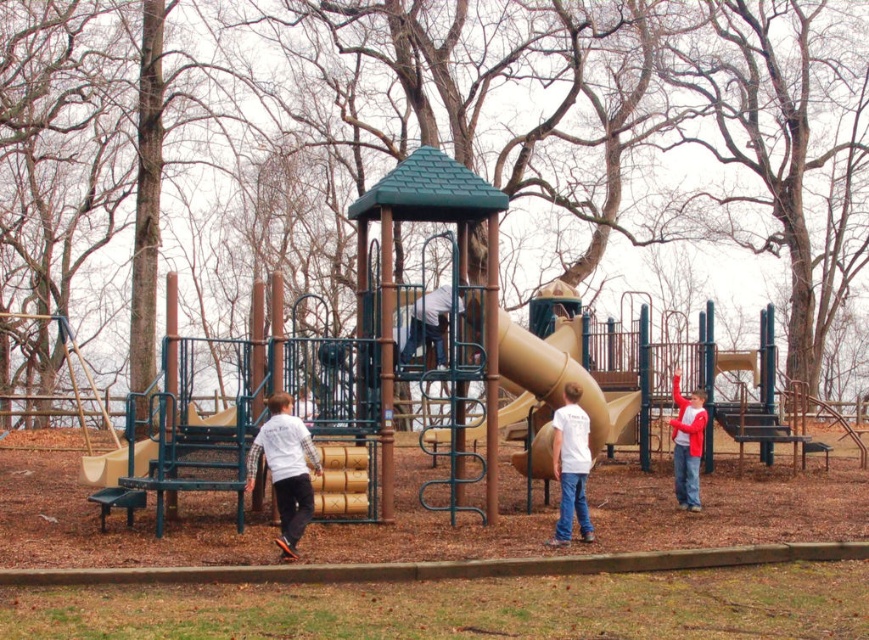
Question: Can you confirm if white matte shirt at center is positioned to the left of white t-shirt at center?

Choices:
 (A) no
 (B) yes

Answer: (B)

Question: Is red fleece jacket at right wider than smooth tan slide at lower left?

Choices:
 (A) no
 (B) yes

Answer: (A)

Question: Which object appears closest to the camera in this image?

Choices:
 (A) smooth tan slide at lower left
 (B) red fleece jacket at right
 (C) white matte shirt at center

Answer: (C)

Question: In this image, where is beige rubber slide at center located relative to white t-shirt at center?

Choices:
 (A) above
 (B) below

Answer: (A)

Question: Which point is farther to the camera?

Choices:
 (A) white t-shirt at center
 (B) red fleece jacket at right
 (C) beige rubber slide at center
 (D) white matte shirt at center

Answer: (B)

Question: Which point is farther to the camera?

Choices:
 (A) beige rubber slide at center
 (B) red fleece jacket at right

Answer: (B)